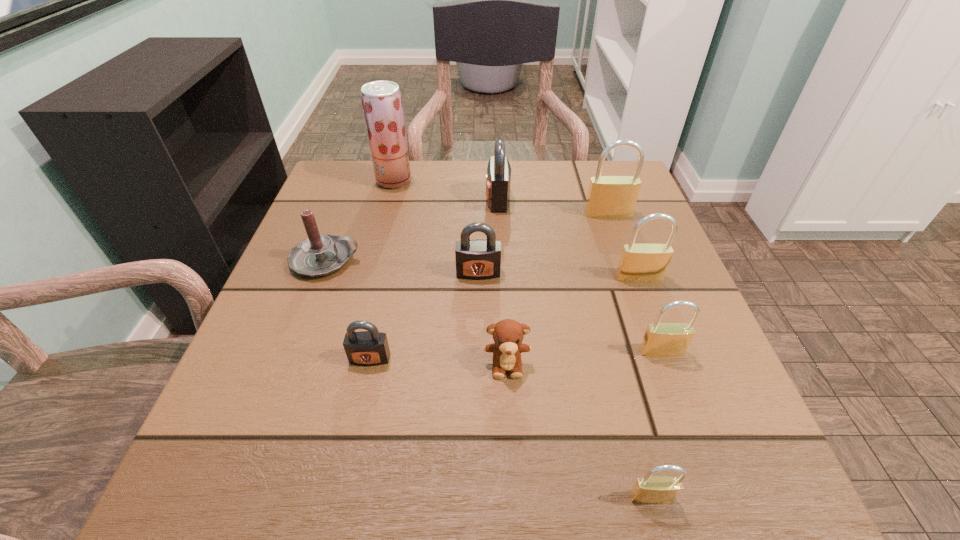
The height and width of the screenshot is (540, 960). Identify the location of object that is at the far right corner. (608, 196).

I want to click on object located in the near right corner section of the desktop, so click(x=649, y=489).

Image resolution: width=960 pixels, height=540 pixels. In order to click on vacant area at the far edge in this screenshot , I will do `click(529, 191)`.

Locate an element on the screen. This screenshot has width=960, height=540. blank space at the near edge of the desktop is located at coordinates (576, 464).

The image size is (960, 540). Identify the location of vacant position at the left edge of the desktop. (334, 319).

Find the location of a particular element. vacant region at the right edge is located at coordinates (637, 356).

At what (x,y) coordinates should I click in order to perform the action: click on vacant region at the far left corner. Please return your answer as a coordinate pair (x, y). Looking at the image, I should click on (366, 165).

Image resolution: width=960 pixels, height=540 pixels. Identify the location of free space at the far right corner of the desktop. (643, 213).

Locate an element on the screen. The width and height of the screenshot is (960, 540). vacant space that's between the candle and the third farthest brass padlock is located at coordinates (493, 306).

Find the location of a particular element. The image size is (960, 540). unoccupied area between the candle and the teddy bear is located at coordinates (417, 312).